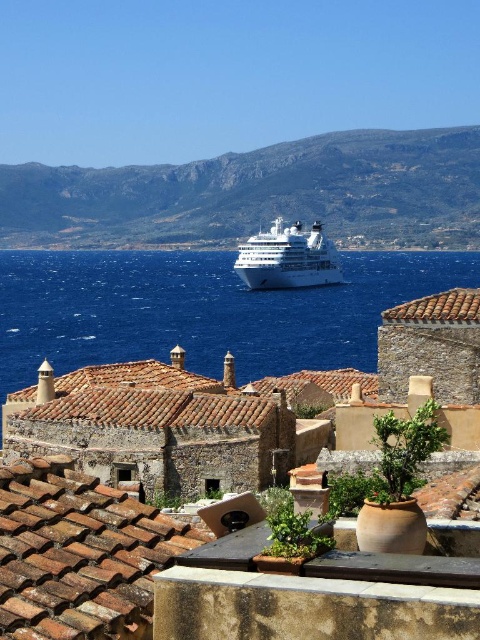
You are a photographer planning to capture the coastal scene. You want to ensure that the blue liquid water at center is prominently featured in the foreground while also including the white glossy cruise ship at center. Given their relative sizes, how should you position your camera to achieve this composition?

The blue liquid water at center is much taller than the white glossy cruise ship at center. To emphasize the water in the foreground while including the cruise ship, position the camera lower to the ground, focusing on the water area first, then frame the shot so the cruise ship appears smaller in the background.

You are standing on the hilltop overlooking the Mediterranean village. You see a point marked at coordinates (202, 310). Based on the scene, what is this point likely located on?

The point marked at coordinates (202, 310) is on blue liquid water at center, so it is likely located on the calm sea where the cruise ship is anchored.